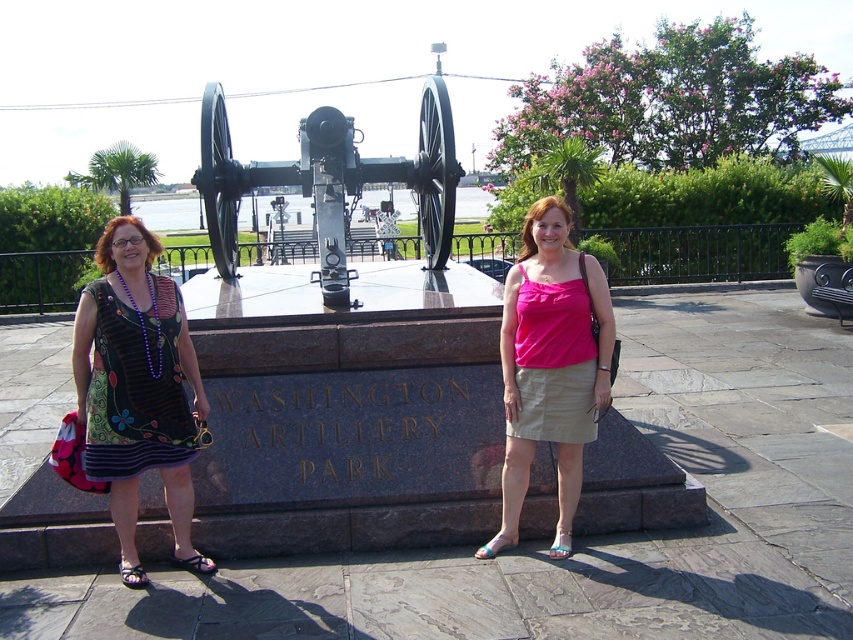
Is floral dress at left above pink fabric tank top at center?

No.

Which is more to the left, floral dress at left or pink fabric tank top at center?

floral dress at left

Does point (160, 250) lie in front of point (598, 289)?

Yes.

At what (x,y) coordinates should I click in order to perform the action: click on floral dress at left. Please return your answer as a coordinate pair (x, y). Looking at the image, I should click on click(x=137, y=388).